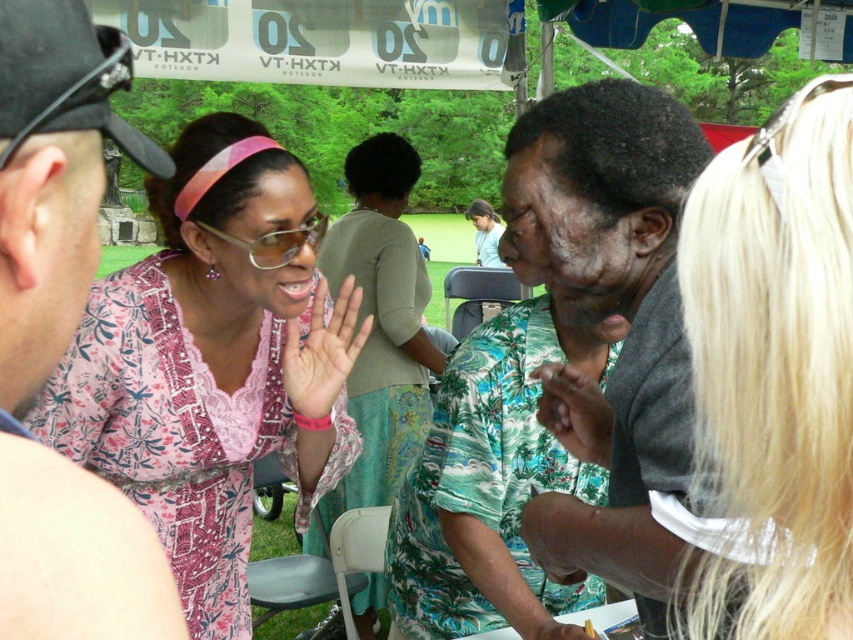
Is pink floral dress at center taller than green floral shirt at center?

Correct, pink floral dress at center is much taller as green floral shirt at center.

Does pink floral dress at center have a greater width compared to green floral shirt at center?

Indeed, pink floral dress at center has a greater width compared to green floral shirt at center.

Who is more forward, (158,348) or (674,381)?

Point (674,381) is in front.

Locate an element on the screen. This screenshot has height=640, width=853. pink floral dress at center is located at coordinates (213, 362).

Does pink floral shirt at upper left lie behind pink lace dress at center?

No, it is in front of pink lace dress at center.

Who is lower down, pink floral shirt at upper left or pink lace dress at center?

pink floral shirt at upper left is lower down.

Where is `pink floral shirt at upper left`? pink floral shirt at upper left is located at coordinates (62, 332).

Which is more to the left, green floral shirt at center or pink lace dress at center?

pink lace dress at center

Can you confirm if green floral shirt at center is bigger than pink lace dress at center?

No.

What do you see at coordinates (606, 314) in the screenshot? I see `green floral shirt at center` at bounding box center [606, 314].

This screenshot has height=640, width=853. Identify the location of green floral shirt at center. (606, 314).